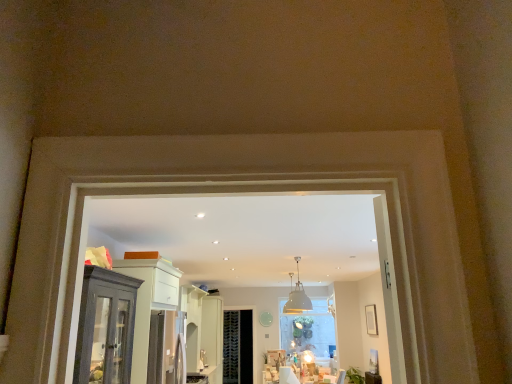
Question: From a real-world perspective, is satin silver fridge at center under black mesh screen door at center?

Choices:
 (A) no
 (B) yes

Answer: (B)

Question: From the image's perspective, would you say satin silver fridge at center is shown under black mesh screen door at center?

Choices:
 (A) no
 (B) yes

Answer: (A)

Question: Is satin silver fridge at center not inside black mesh screen door at center?

Choices:
 (A) yes
 (B) no

Answer: (A)

Question: Is satin silver fridge at center surrounding black mesh screen door at center?

Choices:
 (A) no
 (B) yes

Answer: (A)

Question: Considering the relative sizes of satin silver fridge at center and black mesh screen door at center in the image provided, is satin silver fridge at center thinner than black mesh screen door at center?

Choices:
 (A) yes
 (B) no

Answer: (B)

Question: Can you confirm if satin silver fridge at center is wider than black mesh screen door at center?

Choices:
 (A) yes
 (B) no

Answer: (A)

Question: Considering the relative sizes of satin silver fridge at center and matte dark wood cabinet at left in the image provided, is satin silver fridge at center wider than matte dark wood cabinet at left?

Choices:
 (A) yes
 (B) no

Answer: (B)

Question: From the image's perspective, is satin silver fridge at center located beneath matte dark wood cabinet at left?

Choices:
 (A) yes
 (B) no

Answer: (A)

Question: From a real-world perspective, is satin silver fridge at center under matte dark wood cabinet at left?

Choices:
 (A) no
 (B) yes

Answer: (B)

Question: Is satin silver fridge at center bigger than matte dark wood cabinet at left?

Choices:
 (A) yes
 (B) no

Answer: (B)

Question: Would you say satin silver fridge at center is outside matte dark wood cabinet at left?

Choices:
 (A) yes
 (B) no

Answer: (A)

Question: Is satin silver fridge at center shorter than matte dark wood cabinet at left?

Choices:
 (A) no
 (B) yes

Answer: (B)

Question: From the image's perspective, would you say white glossy door at center is shown under satin silver fridge at center?

Choices:
 (A) yes
 (B) no

Answer: (A)